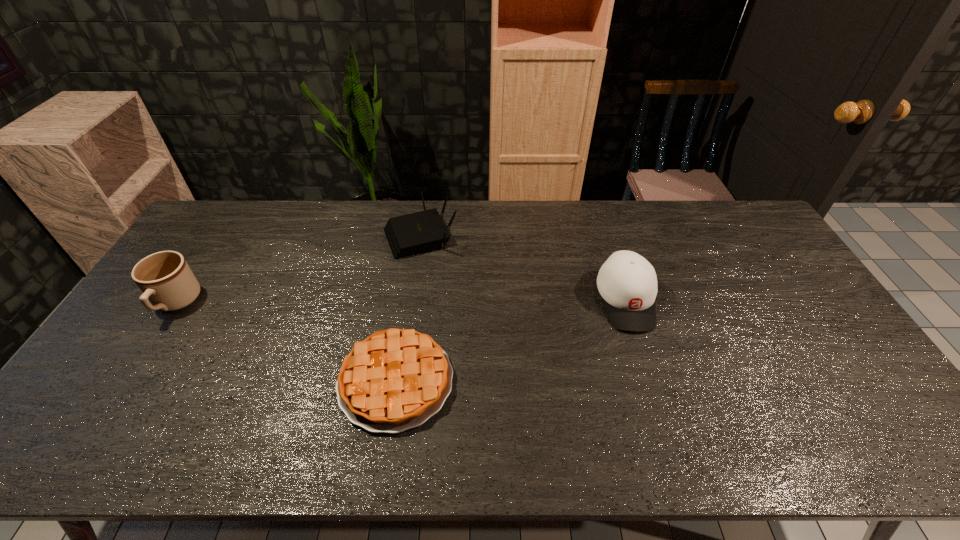
Where is `the leftmost object`? The image size is (960, 540). the leftmost object is located at coordinates (165, 278).

Find the location of a particular element. This screenshot has width=960, height=540. baseball cap is located at coordinates (627, 282).

At what (x,y) coordinates should I click in order to perform the action: click on the third tallest object. Please return your answer as a coordinate pair (x, y). Looking at the image, I should click on (419, 232).

You are a GUI agent. You are given a task and a screenshot of the screen. Output one action in this format:
    pyautogui.click(x=<x>, y=<y>)
    Task: Click on the router
    The image size is (960, 540).
    Given the screenshot: What is the action you would take?
    pyautogui.click(x=419, y=232)

Identify the location of pie. The width and height of the screenshot is (960, 540). (396, 379).

This screenshot has height=540, width=960. I want to click on the shortest object, so (396, 379).

This screenshot has height=540, width=960. In order to click on vacant region located on the side of the mug with the handle in this screenshot , I will do `click(109, 406)`.

Where is `vacant area situated on the front-facing side of the baseball cap`? vacant area situated on the front-facing side of the baseball cap is located at coordinates (647, 368).

Identify the location of vacant space located on the right of the second shortest object. (523, 235).

Locate an element on the screen. Image resolution: width=960 pixels, height=540 pixels. free space located on the back of the pie is located at coordinates (406, 316).